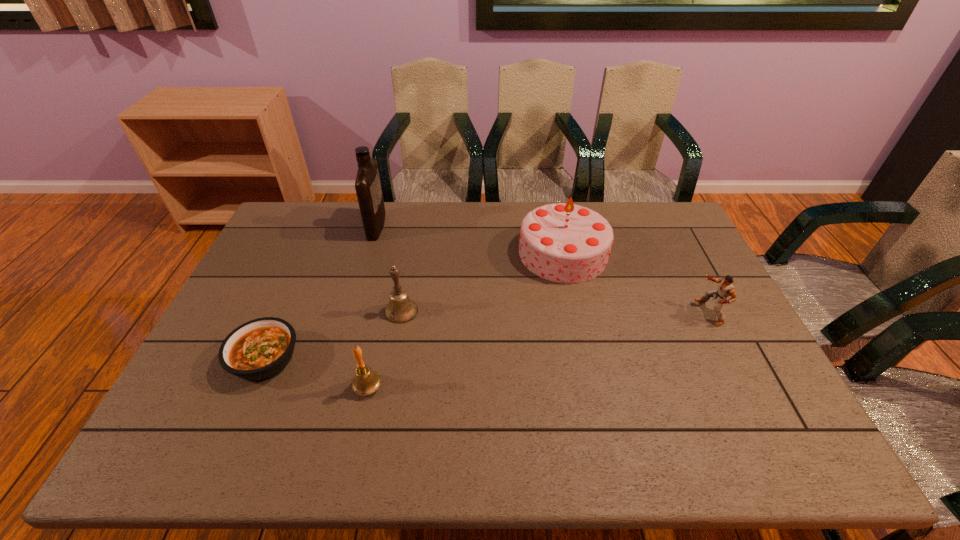
Identify the location of object that is at the right edge. The height and width of the screenshot is (540, 960). (726, 288).

Identify the location of vacant space at the far edge of the desktop. (353, 221).

This screenshot has height=540, width=960. Find the location of `vacant region at the near edge of the desktop`. vacant region at the near edge of the desktop is located at coordinates (281, 427).

The image size is (960, 540). I want to click on free space at the right edge of the desktop, so click(x=746, y=400).

Identify the location of vacant area at the far left corner. The height and width of the screenshot is (540, 960). (307, 220).

Locate an element on the screen. The height and width of the screenshot is (540, 960). vacant space at the far right corner of the desktop is located at coordinates (661, 235).

The image size is (960, 540). What are the coordinates of `unoccupied area between the farther bell and the stew` in the screenshot? It's located at (333, 335).

At what (x,y) coordinates should I click in order to perform the action: click on blank region between the farther bell and the shortest object. Please return your answer as a coordinate pair (x, y). This screenshot has height=540, width=960. Looking at the image, I should click on (333, 335).

The width and height of the screenshot is (960, 540). Find the location of `unoccupied position between the farther bell and the birthday cake`. unoccupied position between the farther bell and the birthday cake is located at coordinates (482, 282).

Locate an element on the screen. This screenshot has width=960, height=540. vacant region between the fifth object from right to left and the farther bell is located at coordinates (389, 268).